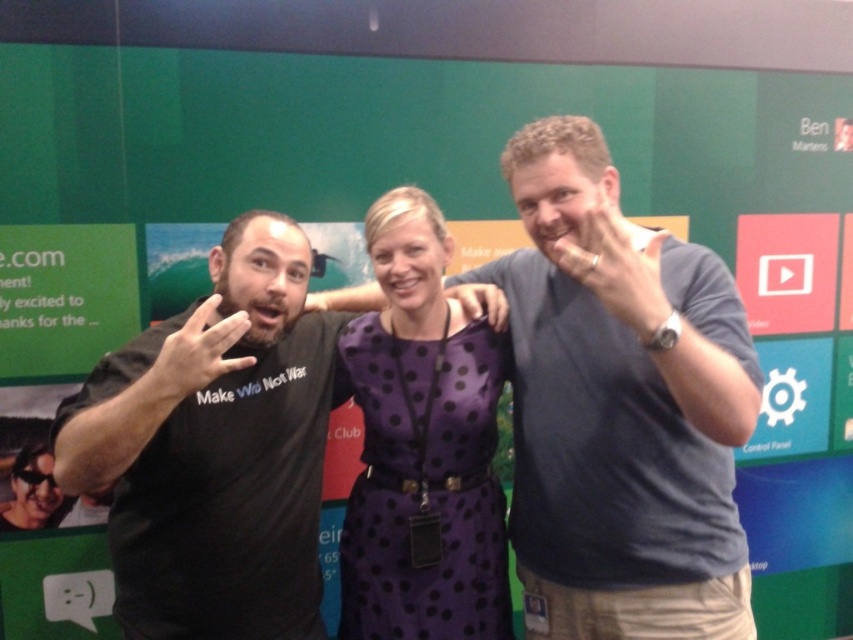
You are a photographer trying to focus on the dark blue shirt at center and the purple satin dress at center. Which one should you adjust your camera focus to first to ensure both are in focus?

The dark blue shirt at center is closer to the viewer than the purple satin dress at center, so you should focus on the dark blue shirt at center first to ensure both are in focus.